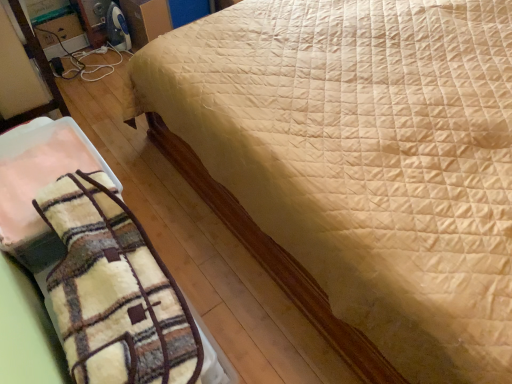
This screenshot has width=512, height=384. Describe the element at coordinates (98, 264) in the screenshot. I see `fuzzy plaid blanket at lower left` at that location.

The height and width of the screenshot is (384, 512). Find the location of `fuzzy plaid blanket at lower left`. fuzzy plaid blanket at lower left is located at coordinates (98, 264).

Where is `fuzzy plaid blanket at lower left`? This screenshot has height=384, width=512. fuzzy plaid blanket at lower left is located at coordinates (98, 264).